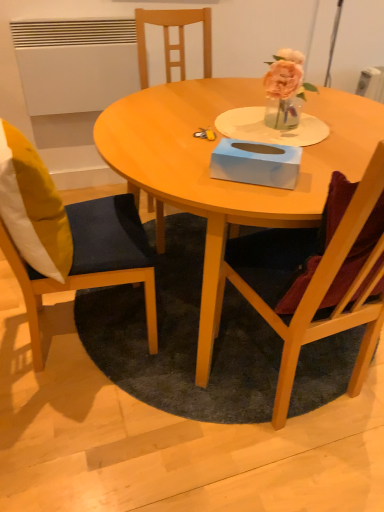
Image resolution: width=384 pixels, height=512 pixels. What are the coordinates of `dark gray carpet at center` in the screenshot? It's located at (182, 339).

Identify the location of wooden chair at left, the first chair in the left-to-right sequence. The height and width of the screenshot is (512, 384). (66, 237).

What do you see at coordinates (33, 207) in the screenshot? I see `yellow fabric pillow at left` at bounding box center [33, 207].

Where is `light blue cardboard tissue box at center`? This screenshot has width=384, height=512. light blue cardboard tissue box at center is located at coordinates (256, 163).

The width and height of the screenshot is (384, 512). What do you see at coordinates (226, 181) in the screenshot?
I see `wooden table at center` at bounding box center [226, 181].

Locate an element on the screen. The image size is (384, 512). dark gray carpet at center is located at coordinates (182, 339).

Is light blue cardboard tissue box at center beside wooden chair at right, arranged as the 2th chair when viewed from the left?

No.

Considering the sizes of objects light blue cardboard tissue box at center and wooden chair at right, positioned as the first chair in right-to-left order, in the image provided, who is thinner, light blue cardboard tissue box at center or wooden chair at right, positioned as the first chair in right-to-left order,?

light blue cardboard tissue box at center is thinner.

Between light blue cardboard tissue box at center and wooden chair at right, arranged as the 2th chair when viewed from the left, which one has less height?

Standing shorter between the two is light blue cardboard tissue box at center.

From the picture: Is light blue cardboard tissue box at center wider than wooden table at center?

No, light blue cardboard tissue box at center is not wider than wooden table at center.

In terms of height, does light blue cardboard tissue box at center look taller or shorter compared to wooden table at center?

Considering their sizes, light blue cardboard tissue box at center has less height than wooden table at center.

Which is correct: light blue cardboard tissue box at center is inside wooden table at center, or outside of it?

light blue cardboard tissue box at center is located beyond the bounds of wooden table at center.

From a real-world perspective, is light blue cardboard tissue box at center over wooden table at center?

Yes, from a real-world perspective, light blue cardboard tissue box at center is on top of wooden table at center.

From the image's perspective, which one is positioned higher, light blue cardboard tissue box at center or dark gray carpet at center?

light blue cardboard tissue box at center, from the image's perspective.

Is the position of light blue cardboard tissue box at center less distant than that of dark gray carpet at center?

Yes, light blue cardboard tissue box at center is in front of dark gray carpet at center.

From the picture: Is there a large distance between light blue cardboard tissue box at center and dark gray carpet at center?

light blue cardboard tissue box at center is actually quite close to dark gray carpet at center.

Could you tell me if wooden chair at right, arranged as the 2th chair when viewed from the left, is facing light blue cardboard tissue box at center?

Yes, wooden chair at right, arranged as the 2th chair when viewed from the left, is aimed at light blue cardboard tissue box at center.

Is wooden chair at right, arranged as the 2th chair when viewed from the left, positioned beyond the bounds of light blue cardboard tissue box at center?

Yes, wooden chair at right, arranged as the 2th chair when viewed from the left, is outside of light blue cardboard tissue box at center.

What's the angular difference between wooden chair at right, arranged as the 2th chair when viewed from the left, and light blue cardboard tissue box at center's facing directions?

The angular difference between wooden chair at right, arranged as the 2th chair when viewed from the left, and light blue cardboard tissue box at center is 36.2 degrees.

Find the location of a particular element. The width and height of the screenshot is (384, 512). box located above the wooden chair at right, arranged as the 2th chair when viewed from the left (from a real-world perspective) is located at coordinates 256,163.

Does wooden chair at right, positioned as the first chair in right-to-left order, have a smaller size compared to dark gray carpet at center?

No, wooden chair at right, positioned as the first chair in right-to-left order, is not smaller than dark gray carpet at center.

Considering the sizes of wooden chair at right, arranged as the 2th chair when viewed from the left, and dark gray carpet at center in the image, is wooden chair at right, arranged as the 2th chair when viewed from the left, wider or thinner than dark gray carpet at center?

wooden chair at right, arranged as the 2th chair when viewed from the left, is thinner than dark gray carpet at center.

Image resolution: width=384 pixels, height=512 pixels. In order to click on chair that appears on the right of dark gray carpet at center in this screenshot , I will do `click(324, 295)`.

What's the angular difference between wooden chair at right, arranged as the 2th chair when viewed from the left, and dark gray carpet at center's facing directions?

90.5 degrees separate the facing orientations of wooden chair at right, arranged as the 2th chair when viewed from the left, and dark gray carpet at center.

Image resolution: width=384 pixels, height=512 pixels. I want to click on box located on the right of yellow fabric pillow at left, so click(256, 163).

Is light blue cardboard tissue box at center spatially inside yellow fabric pillow at left, or outside of it?

light blue cardboard tissue box at center is spatially situated outside yellow fabric pillow at left.

From the image's perspective, between light blue cardboard tissue box at center and yellow fabric pillow at left, which one is located above?

From the image's view, light blue cardboard tissue box at center is above.

Looking at their sizes, would you say light blue cardboard tissue box at center is wider or thinner than yellow fabric pillow at left?

Considering their sizes, light blue cardboard tissue box at center looks slimmer than yellow fabric pillow at left.

From a real-world perspective, is wooden chair at left, the first chair in the left-to-right sequence, physically above dark gray carpet at center?

Yes, from a real-world perspective, wooden chair at left, the first chair in the left-to-right sequence, is above dark gray carpet at center.

Between wooden chair at left, the first chair in the left-to-right sequence, and dark gray carpet at center, which one is positioned behind?

dark gray carpet at center.

Between wooden chair at left, the first chair in the left-to-right sequence, and dark gray carpet at center, which one has larger width?

dark gray carpet at center is wider.

Identify the location of chair on the right of light blue cardboard tissue box at center. (324, 295).

Locate an element on the screen. coffee table that is in front of the light blue cardboard tissue box at center is located at coordinates (226, 181).

Looking at the image, which one is located further to wooden table at center, dark gray carpet at center or wooden chair at left, the first chair in the left-to-right sequence?

dark gray carpet at center is positioned further to the anchor wooden table at center.

Looking at the image, which one is located further to wooden chair at left, the first chair in the left-to-right sequence, light blue cardboard tissue box at center or dark gray carpet at center?

The object further to wooden chair at left, the first chair in the left-to-right sequence, is light blue cardboard tissue box at center.

From the image, which object appears to be nearer to yellow fabric pillow at left, wooden chair at left, the first chair in the left-to-right sequence, or wooden chair at right, arranged as the 2th chair when viewed from the left?

Based on the image, wooden chair at left, the first chair in the left-to-right sequence, appears to be nearer to yellow fabric pillow at left.

Based on their spatial positions, is light blue cardboard tissue box at center or wooden chair at left, the first chair in the left-to-right sequence, further from wooden table at center?

Based on the image, wooden chair at left, the first chair in the left-to-right sequence, appears to be further to wooden table at center.

Considering their positions, is wooden table at center positioned further to yellow fabric pillow at left than wooden chair at right, positioned as the first chair in right-to-left order?

Based on the image, wooden chair at right, positioned as the first chair in right-to-left order, appears to be further to yellow fabric pillow at left.

Looking at this image, estimate the real-world distances between objects in this image. Which object is closer to wooden chair at left, the first chair in the left-to-right sequence, wooden chair at right, positioned as the first chair in right-to-left order, or yellow fabric pillow at left?

yellow fabric pillow at left is positioned closer to the anchor wooden chair at left, the first chair in the left-to-right sequence.

Based on their spatial positions, is wooden chair at right, arranged as the 2th chair when viewed from the left, or dark gray carpet at center further from yellow fabric pillow at left?

Based on the image, wooden chair at right, arranged as the 2th chair when viewed from the left, appears to be further to yellow fabric pillow at left.

When comparing their distances from wooden chair at left, which is counted as the 2th chair, starting from the right, does light blue cardboard tissue box at center or yellow fabric pillow at left seem further?

Based on the image, light blue cardboard tissue box at center appears to be further to wooden chair at left, which is counted as the 2th chair, starting from the right.

The width and height of the screenshot is (384, 512). I want to click on mat situated between yellow fabric pillow at left and wooden table at center from left to right, so click(x=182, y=339).

You are a GUI agent. You are given a task and a screenshot of the screen. Output one action in this format:
    pyautogui.click(x=<x>, y=<y>)
    Task: Click on the chair between yellow fabric pillow at left and dark gray carpet at center
    
    Given the screenshot: What is the action you would take?
    pyautogui.click(x=66, y=237)

This screenshot has width=384, height=512. Find the location of `mat located between wooden chair at left, the first chair in the left-to-right sequence, and wooden chair at right, arranged as the 2th chair when viewed from the left, in the left-right direction`. mat located between wooden chair at left, the first chair in the left-to-right sequence, and wooden chair at right, arranged as the 2th chair when viewed from the left, in the left-right direction is located at coordinates (182, 339).

This screenshot has width=384, height=512. Identify the location of box between yellow fabric pillow at left and wooden chair at right, positioned as the first chair in right-to-left order, in the horizontal direction. (256, 163).